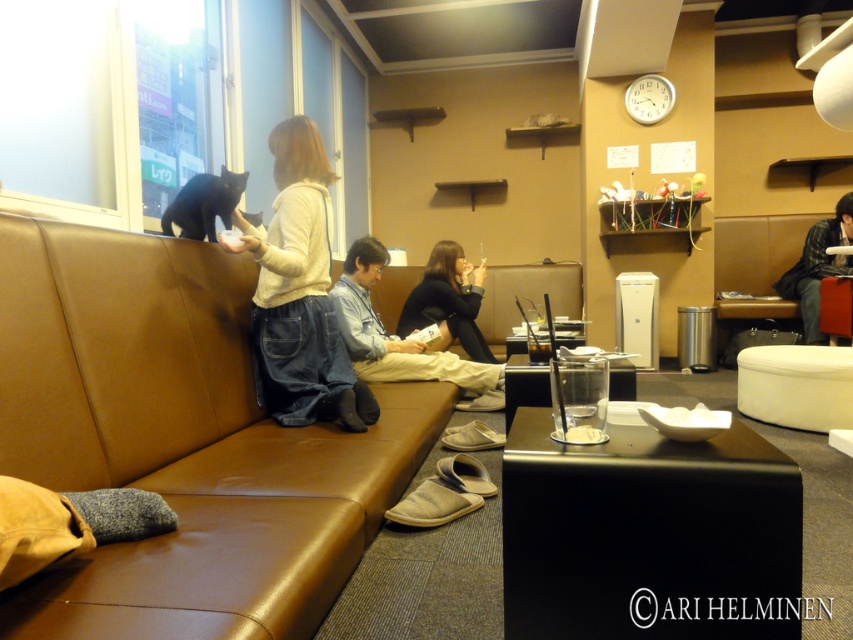
You are a photographer positioned in front of the scene. You want to take a photo focusing on the brown leather couch at center and the plaid flannel shirt at right. Which object should you adjust your camera focus to first to ensure both are in sharp focus?

The brown leather couch at center is closer to the viewer than the plaid flavel shirt at right, so you should focus on the brown leather couch at center first. This will ensure the plaid flannel shirt at right is also in focus since it is further away.

Based on the photo, you are a photographer taking a picture of the scene. You need to focus on the denim jeans at center and the plaid flannel shirt at right. Which object should you focus on first to ensure both are in sharp focus?

You should focus on the denim jeans at center first because it is closer to the viewer than the plaid flannel shirt at right. By focusing on the closer object, the farther one will also be in focus due to the depth of field.